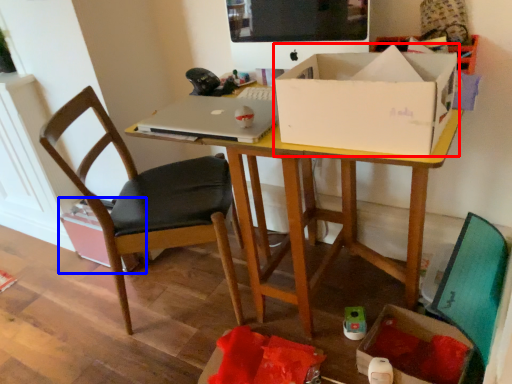
Question: Which object appears farthest to the camera in this image, box (highlighted by a red box) or cardboard box (highlighted by a blue box)?

Choices:
 (A) box
 (B) cardboard box

Answer: (B)